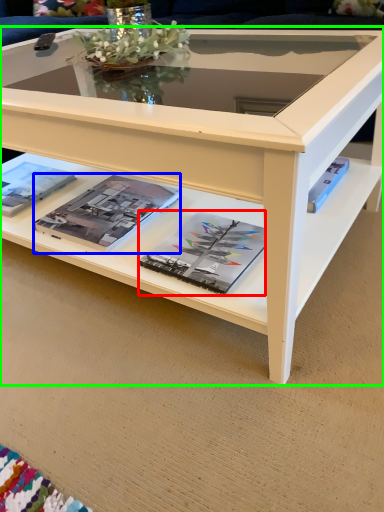
Question: Which is farther away from magazine (highlighted by a red box)? magazine (highlighted by a blue box) or coffee table (highlighted by a green box)?

Choices:
 (A) magazine
 (B) coffee table

Answer: (B)